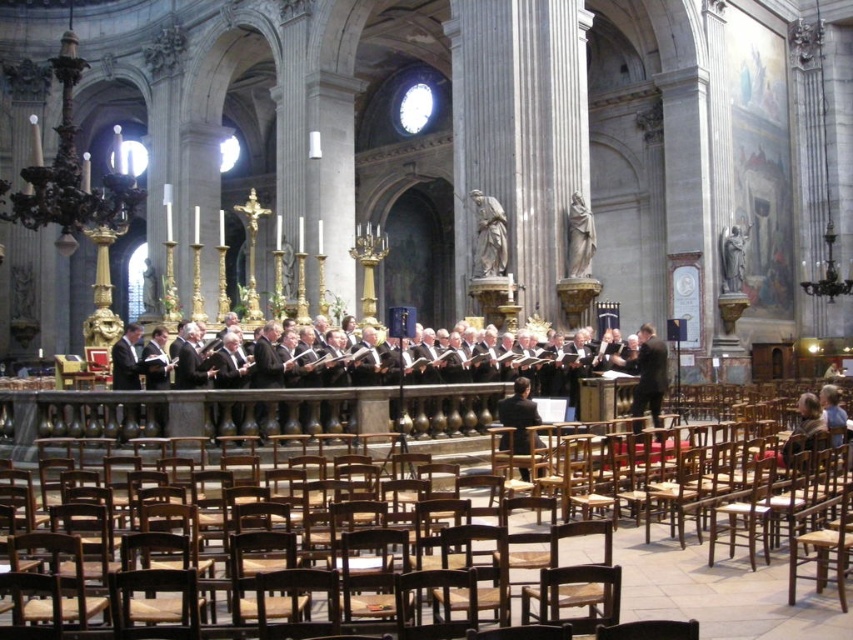
You are standing at the entrance of the cathedral and want to reach the white marble statue at center. There is a wooden chair at center in your path. Can you walk straight ahead without moving the chair?

The wooden chair at center is in front of the white marble statue at center, so you cannot walk straight ahead without moving the wooden chair at center.

You are an event planner arranging seating for a concert in the cathedral. You have a wooden chair at center and a black suit at right. Which object takes up more space in the image?

The wooden chair at center takes up more space in the image because it is bigger than the black suit at right.

You are standing at the entrance of the cathedral and want to sit down. There is a wooden chair at center located at point (718,589). Can you walk directly to it without moving around any obstacles?

Yes, you can walk directly to the wooden chair at center located at point (718,589) because there are no obstacles mentioned in the scene description between your starting position at the entrance and the chair.